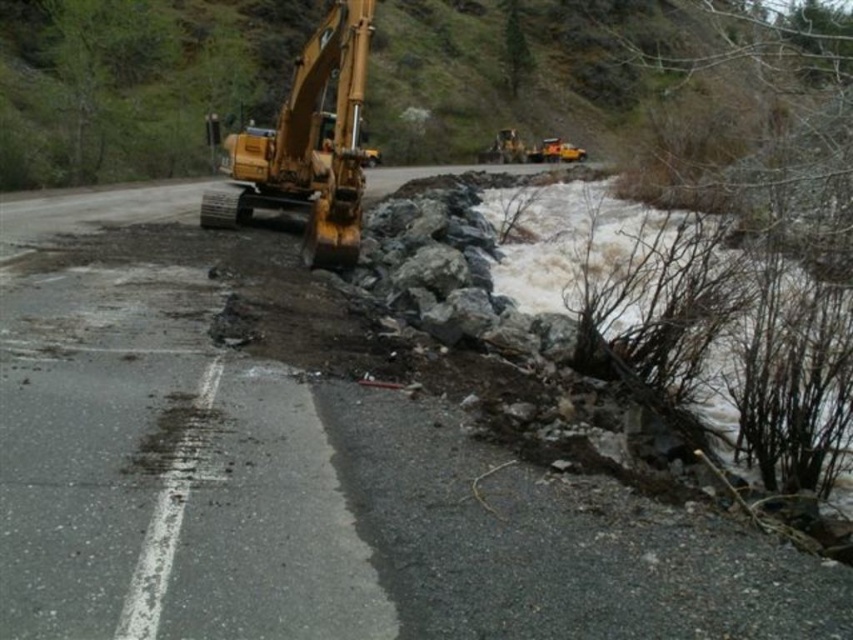
You are a construction worker assessing the damaged road. You see the yellow metallic excavator at left and the yellow metallic excavator at center. Which one is bigger?

The yellow metallic excavator at left is larger in size compared to the yellow metallic excavator at center.

You are a construction worker assessing the flooded road. You need to determine if the white frothy water at lower right can fit entirely within the space occupied by the yellow metallic excavator at center. Based on their widths, what is your conclusion?

The white frothy water at lower right has a lesser width compared to the yellow metallic excavator at center, so it can fit entirely within the space occupied by the yellow metallic excavator at center.

You are a construction worker assessing the flooded road. You see the white frothy water at lower right and the yellow metallic excavator at left. Which object is taller?

The yellow metallic excavator at left is taller than the white frothy water at lower right.